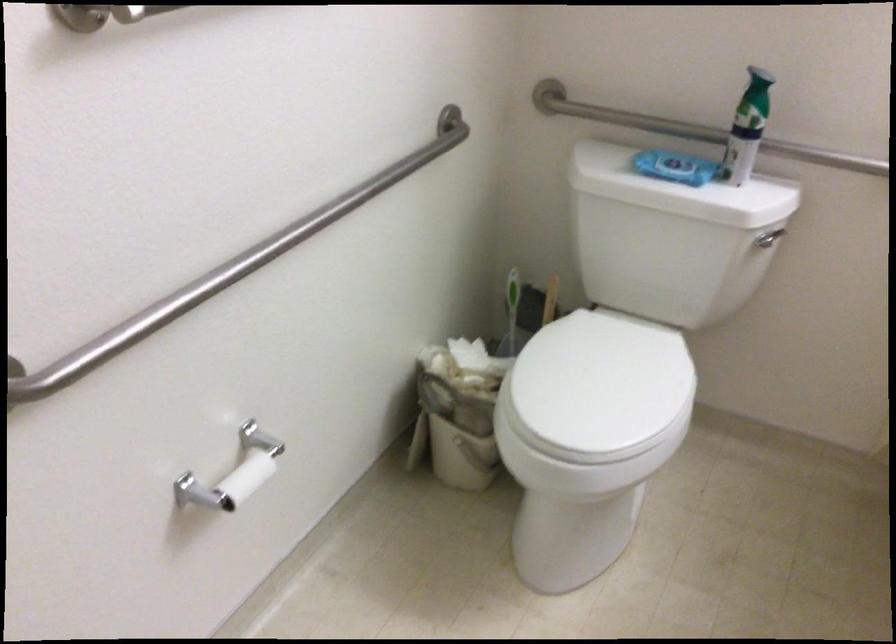
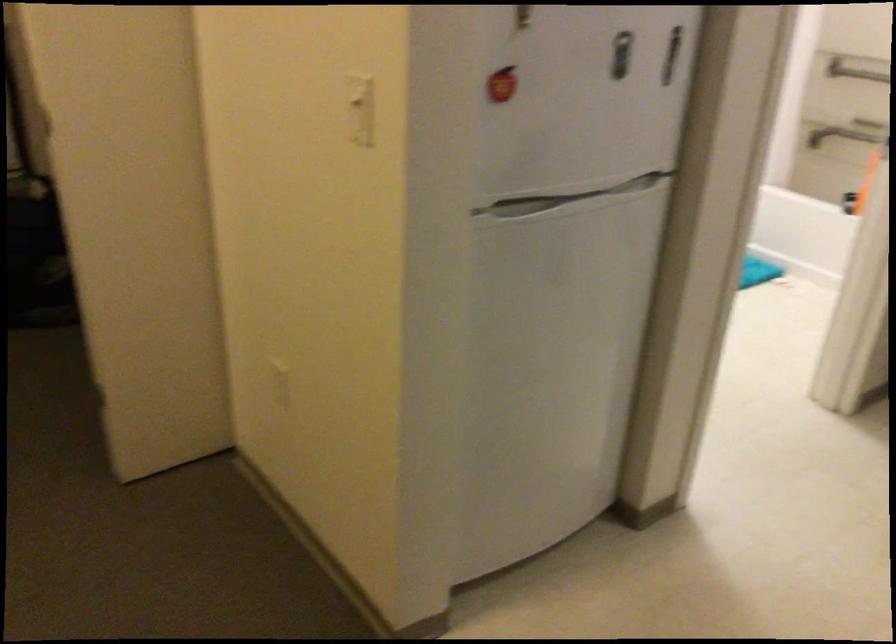
Question: I am providing you with two images of the same scene from different viewpoints. After the viewpoint changes to image2, which objects are now occluded?

Choices:
 (A) small rice cooker
 (B) metal grab bar
 (C) white toilet seat
 (D) red apple magnet

Answer: (C)